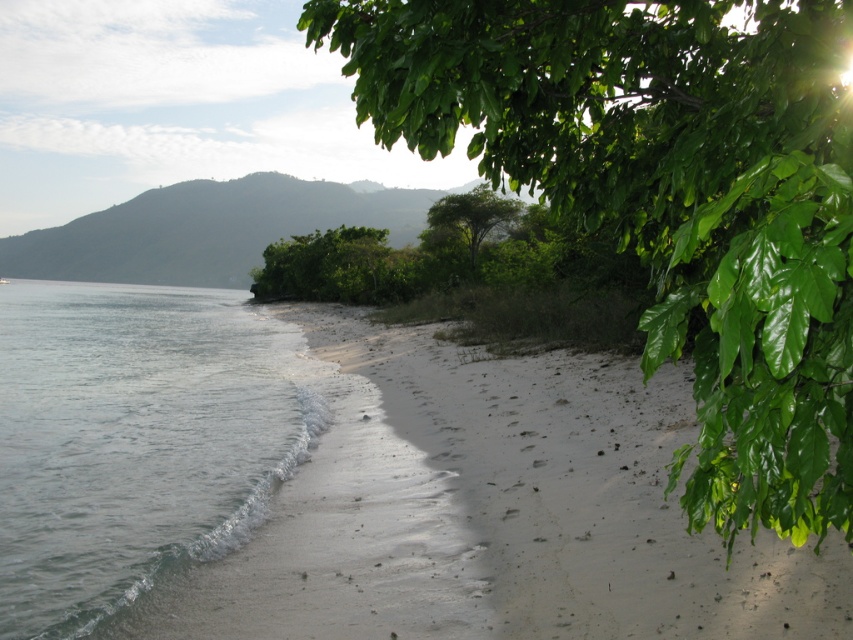
Question: Does sandy beach at lower left lie behind clear water at lower left?

Choices:
 (A) yes
 (B) no

Answer: (B)

Question: Considering the real-world distances, which object is closest to the green leafy tree at center?

Choices:
 (A) sandy beach at lower left
 (B) green leafy tree at upper right

Answer: (A)

Question: Estimate the real-world distances between objects in this image. Which object is closer to the green leafy tree at center?

Choices:
 (A) sandy beach at lower left
 (B) clear water at lower left
 (C) green leafy tree at upper right

Answer: (B)

Question: Is green leafy tree at upper right below clear water at lower left?

Choices:
 (A) yes
 (B) no

Answer: (B)

Question: Which point is closer to the camera?

Choices:
 (A) (665, 228)
 (B) (447, 209)
 (C) (604, 611)

Answer: (A)

Question: Does clear water at lower left lie in front of green leafy tree at center?

Choices:
 (A) yes
 (B) no

Answer: (A)